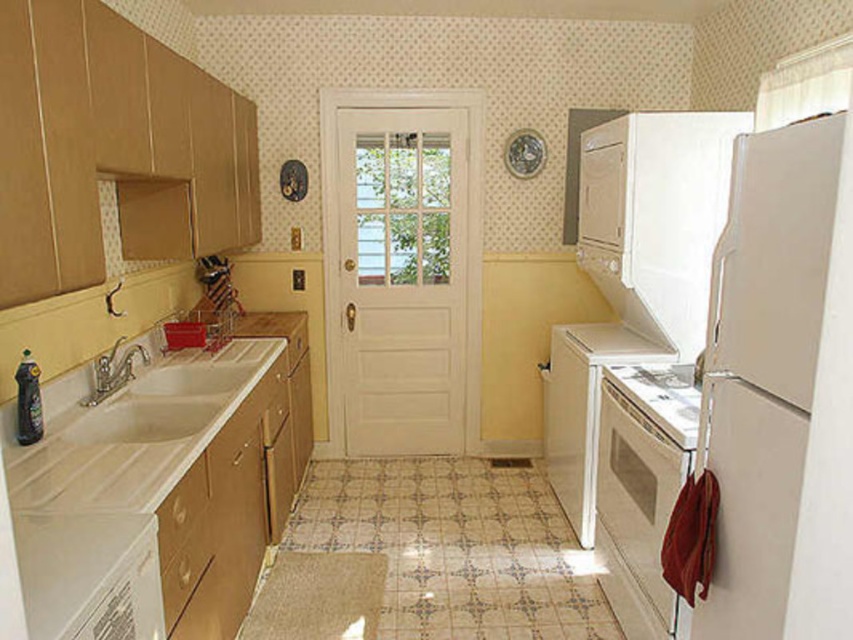
You are standing in the kitchen and need to wash dishes. The white glossy sink at left and the white glossy stove at lower center are both in your view. Which appliance should you approach first to reach the sink?

You should approach the white glossy sink at left first because it is closer to you than the white glossy stove at lower center.

You are a chef preparing to place a large pot on the white glossy countertop at lower left. However, you notice the white glossy sink at left is nearby. Based on their positions, which object is on the right side from your perspective?

The white glossy countertop at lower left is positioned to the right of the white glossy sink at left, so the countertop is on the right side.

You are standing in the vintage kitchen and need to wash dishes. The white glossy sink at left and the white glossy stove at lower center are both in your view. Which appliance should you go to first to start washing dishes?

You should go to the white glossy sink at left first because it is positioned on the left side of the white glossy stove at lower center, making it closer to your current position if you are facing the appliances.